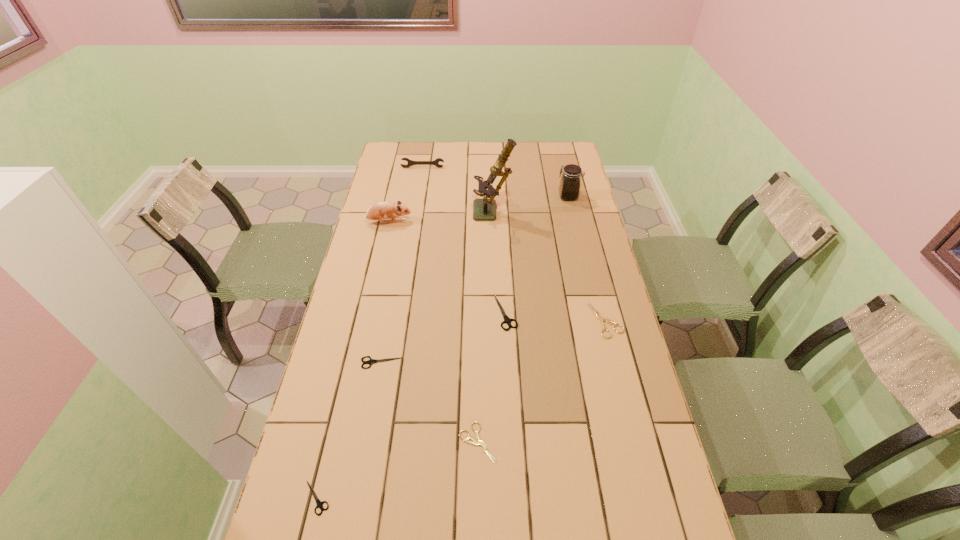
You are a GUI agent. You are given a task and a screenshot of the screen. Output one action in this format:
    pyautogui.click(x=<x>, y=<y>)
    Task: Click on the vacant region located 0.090m on the lid of the jar
    Image resolution: width=960 pixels, height=540 pixels.
    Given the screenshot: What is the action you would take?
    click(536, 197)

This screenshot has width=960, height=540. I want to click on free spot located 0.240m on the lid of the jar, so click(500, 197).

Locate an element on the screen. The width and height of the screenshot is (960, 540). free space located on the lid of the jar is located at coordinates (542, 197).

At what (x,y) coordinates should I click in order to perform the action: click on vacant space located 0.270m at the face of the hamster. Please return your answer as a coordinate pair (x, y). This screenshot has width=960, height=540. Looking at the image, I should click on [479, 222].

Locate an element on the screen. The height and width of the screenshot is (540, 960). vacant area located on the open ends of the wrench is located at coordinates (420, 181).

Locate an element on the screen. The image size is (960, 540). vacant region located 0.240m on the left of the fifth tallest object is located at coordinates (421, 313).

Identify the location of free space located on the back of the second smallest black shears. tap(393, 303).

Where is `free spot located 0.240m on the front of the rightmost shears`? free spot located 0.240m on the front of the rightmost shears is located at coordinates (628, 410).

This screenshot has height=540, width=960. I want to click on vacant point located on the left of the second nearest shears, so click(x=420, y=442).

This screenshot has width=960, height=540. Identify the location of free space located 0.270m on the back of the nearest black shears. (345, 383).